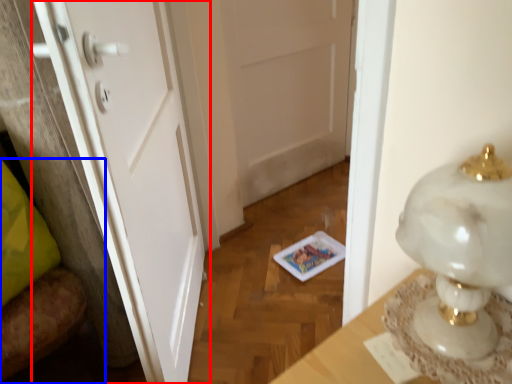
Question: Among these objects, which one is farthest to the camera, door (highlighted by a red box) or furniture (highlighted by a blue box)?

Choices:
 (A) door
 (B) furniture

Answer: (B)